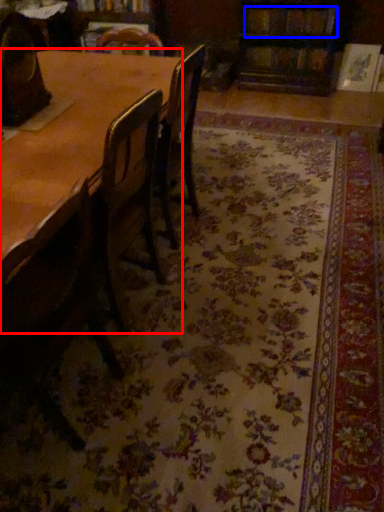
Question: Which of the following is the farthest to the observer, table (highlighted by a red box) or book (highlighted by a blue box)?

Choices:
 (A) table
 (B) book

Answer: (B)